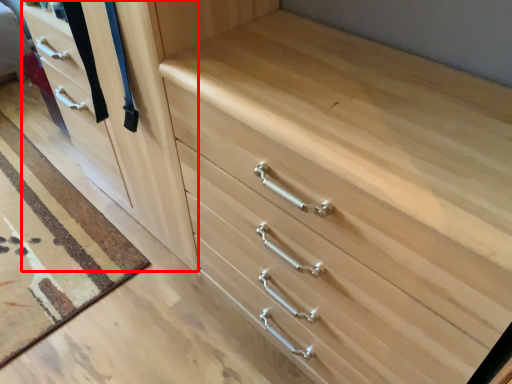
Question: From the image's perspective, where is door (annotated by the red box) located in relation to drawer in the image?

Choices:
 (A) above
 (B) below

Answer: (A)